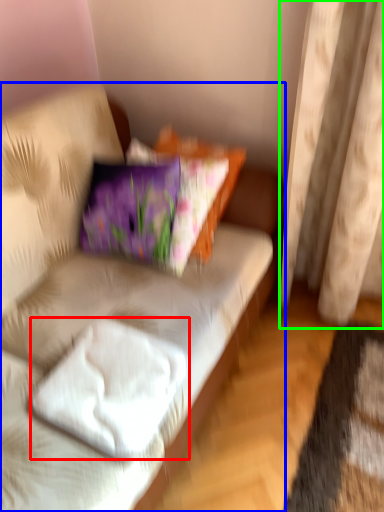
Question: Which object is the closest to the pillow (highlighted by a red box)? Choose among these: studio couch (highlighted by a blue box) or curtain (highlighted by a green box).

Choices:
 (A) studio couch
 (B) curtain

Answer: (A)